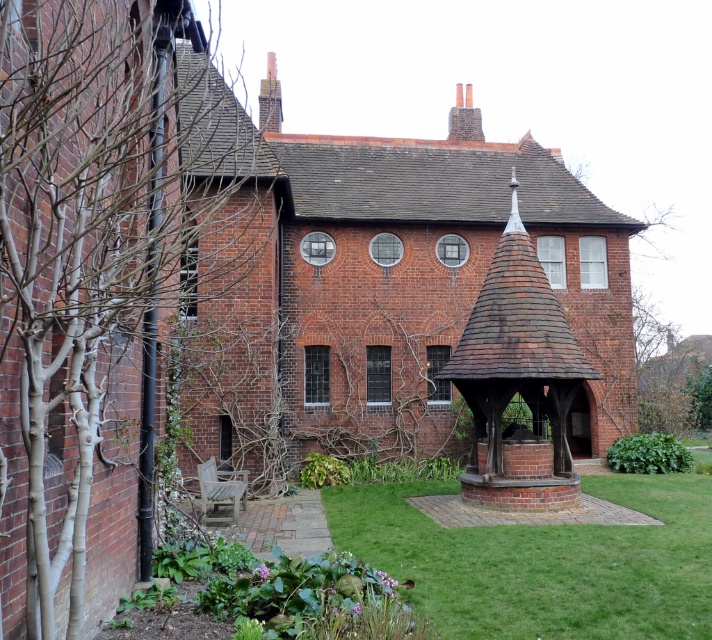
Does green grass at center come behind brown wooden gazebo at center?

No, green grass at center is closer to the viewer.

Is green grass at center positioned in front of brown wooden gazebo at center?

Yes, it is.

In the scene shown: Who is more forward, (451, 579) or (518, 365)?

Point (451, 579) is in front.

In order to click on green grass at center in this screenshot , I will do `click(543, 561)`.